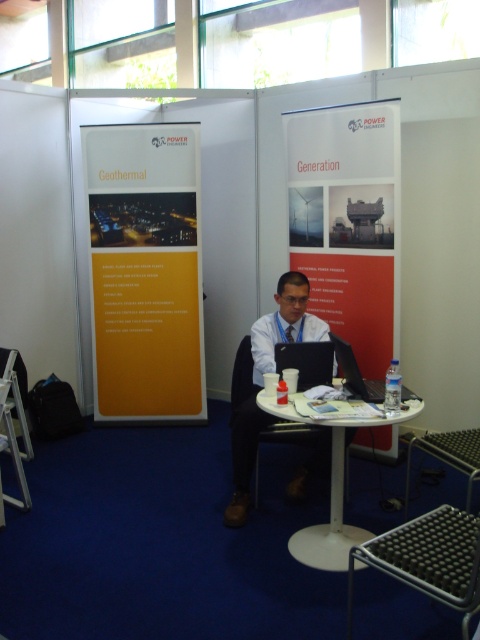
You are an event planner trying to arrange a photo shoot in the booth. The photographer wants to ensure the red matte poster at center and the matte black suit at center are both visible in the frame. Given their sizes, which object should be placed closer to the camera to ensure both are fully visible?

The red matte poster at center is much taller than the matte black suit at center, so to ensure both are fully visible in the frame, the matte black suit at center should be placed closer to the camera while the red matte poster at center can be positioned slightly further back.

You are a visitor at the conference booth and want to place a small brochure on the table. If you walk towards the white plastic table at center from the front, where should you place the brochure so it doesn not cover the red matte poster at center?

The red matte poster at center is positioned on the right side of the white plastic table at center. To avoid covering it, place the brochure on the left side of the white plastic table at center.